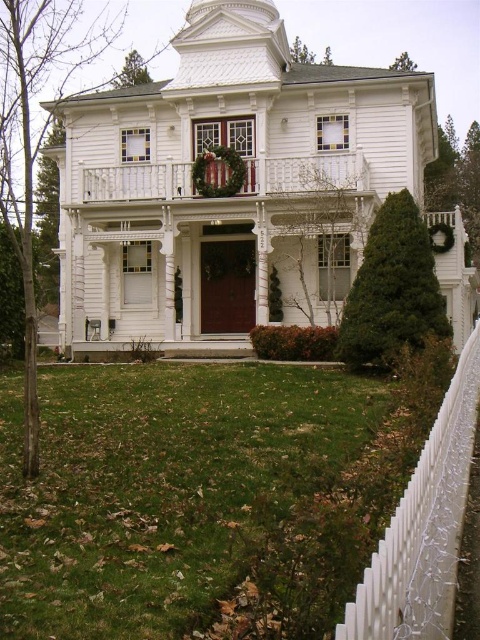
Question: Observing the image, what is the correct spatial positioning of green grass at lower left in reference to white picket fence at right?

Choices:
 (A) left
 (B) right

Answer: (A)

Question: Is green grass at lower left bigger than white wooden porch at upper center?

Choices:
 (A) yes
 (B) no

Answer: (A)

Question: Which point is closer to the camera?

Choices:
 (A) (40, 557)
 (B) (178, 170)

Answer: (A)

Question: Can you confirm if white picket fence at right is wider than white wooden porch at upper center?

Choices:
 (A) yes
 (B) no

Answer: (B)

Question: Which point appears closest to the camera in this image?

Choices:
 (A) (195, 442)
 (B) (100, 168)
 (C) (405, 566)

Answer: (C)

Question: Which object appears closest to the camera in this image?

Choices:
 (A) green grass at lower left
 (B) white wooden porch at upper center

Answer: (A)